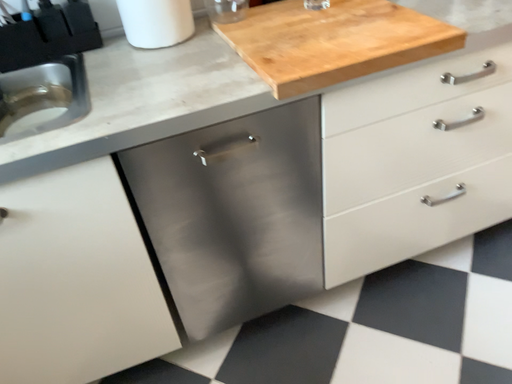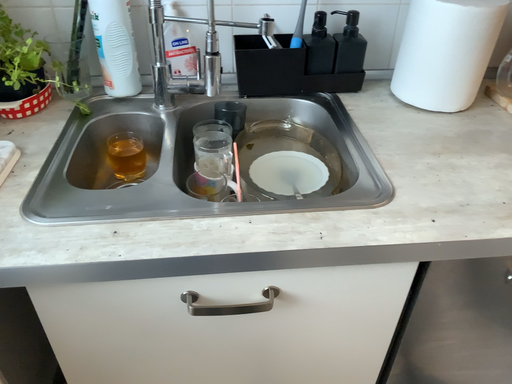
Question: Which way did the camera rotate in the video?

Choices:
 (A) rotated left
 (B) rotated right

Answer: (A)